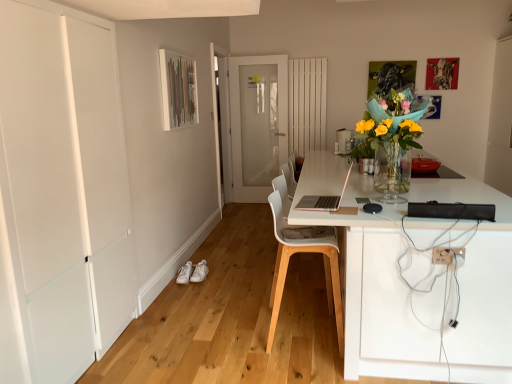
Question: Is white plastic chair at center closer to the viewer compared to white leather shoe at lower center, placed as the 1th shoe when sorted from right to left?

Choices:
 (A) no
 (B) yes

Answer: (B)

Question: Considering the relative sizes of white plastic chair at center and white leather shoe at lower center, placed as the 1th shoe when sorted from right to left, in the image provided, is white plastic chair at center smaller than white leather shoe at lower center, placed as the 1th shoe when sorted from right to left,?

Choices:
 (A) yes
 (B) no

Answer: (B)

Question: Is white plastic chair at center thinner than white leather shoe at lower center, the 2th shoe from the left?

Choices:
 (A) yes
 (B) no

Answer: (B)

Question: Is white plastic chair at center not close to white leather shoe at lower center, the 2th shoe from the left?

Choices:
 (A) yes
 (B) no

Answer: (A)

Question: Does white plastic chair at center appear on the right side of white leather shoe at lower center, placed as the 1th shoe when sorted from right to left?

Choices:
 (A) no
 (B) yes

Answer: (B)

Question: Is the position of white plastic chair at center more distant than that of white leather shoe at lower center, placed as the 1th shoe when sorted from right to left?

Choices:
 (A) yes
 (B) no

Answer: (B)

Question: Is the surface of white leather shoe at lower left, which is counted as the second shoe, starting from the right, in direct contact with pink matte laptop at center?

Choices:
 (A) no
 (B) yes

Answer: (A)

Question: Is white leather shoe at lower left, which is counted as the first shoe, starting from the left, at the right side of pink matte laptop at center?

Choices:
 (A) no
 (B) yes

Answer: (A)

Question: From a real-world perspective, is white leather shoe at lower left, which is counted as the second shoe, starting from the right, positioned over pink matte laptop at center based on gravity?

Choices:
 (A) yes
 (B) no

Answer: (B)

Question: Is pink matte laptop at center at the back of white leather shoe at lower left, which is counted as the first shoe, starting from the left?

Choices:
 (A) no
 (B) yes

Answer: (A)

Question: Considering the relative sizes of white leather shoe at lower left, which is counted as the second shoe, starting from the right, and pink matte laptop at center in the image provided, is white leather shoe at lower left, which is counted as the second shoe, starting from the right, taller than pink matte laptop at center?

Choices:
 (A) no
 (B) yes

Answer: (A)

Question: Does white plastic electric outlet at lower right come behind white leather shoe at lower center, the 2th shoe from the left?

Choices:
 (A) yes
 (B) no

Answer: (B)